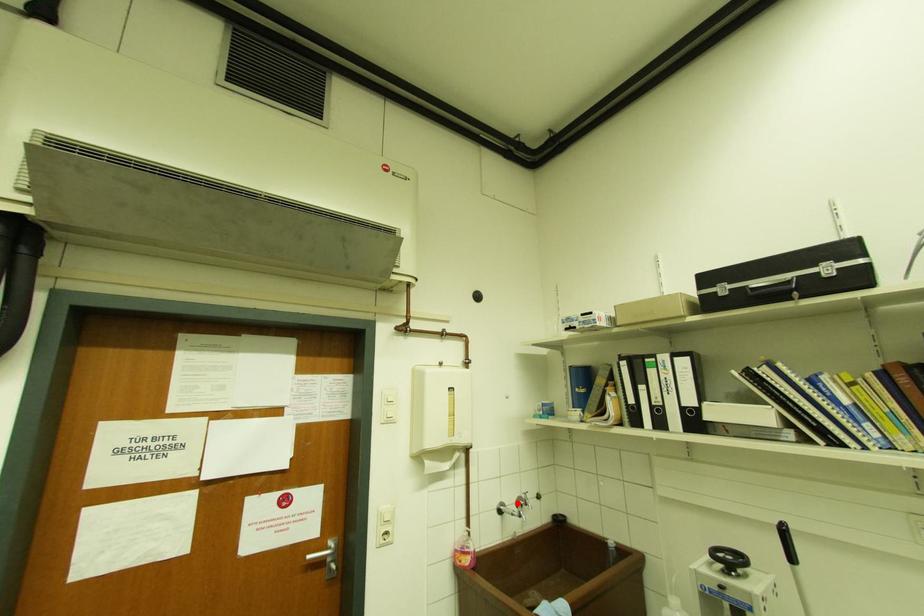
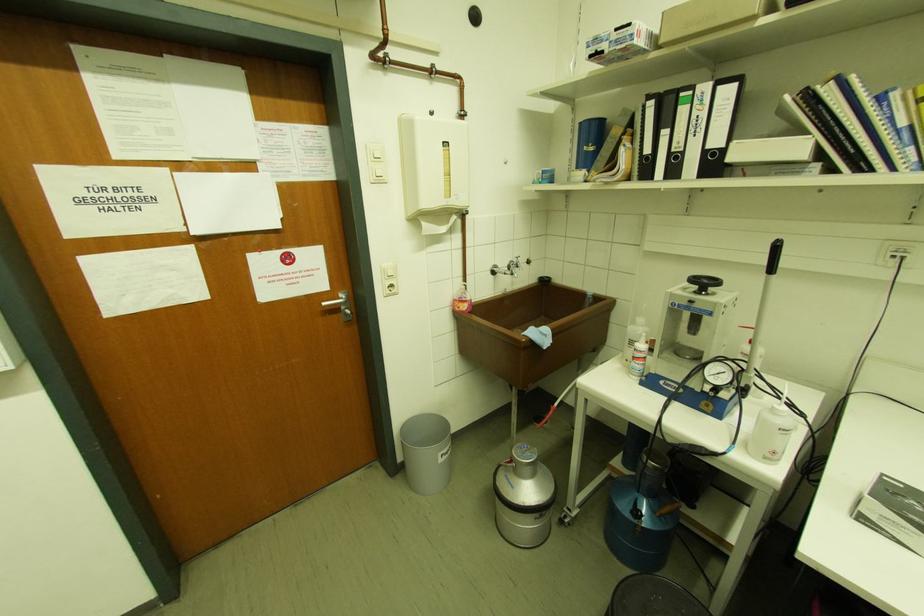
Locate, in the second image, the point that corresponds to the highlighted location in the first image.

(509, 267)